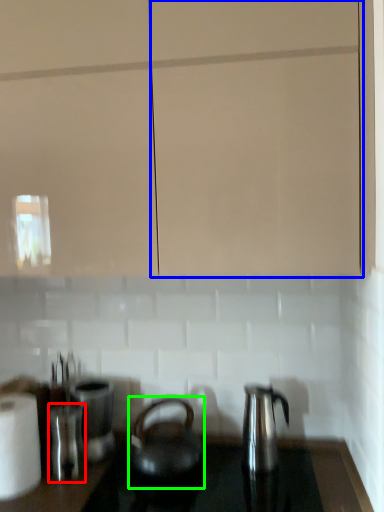
Question: Based on their relative distances, which object is nearer to appliance (highlighted by a red box)? Choose from glass door (highlighted by a blue box) and kettle (highlighted by a green box).

Choices:
 (A) glass door
 (B) kettle

Answer: (B)